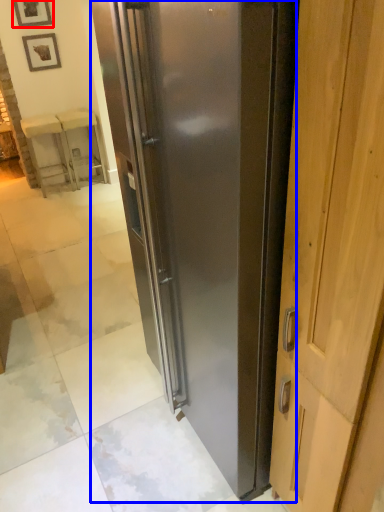
Question: Which object appears closest to the camera in this image, picture frame (highlighted by a red box) or refrigerator (highlighted by a blue box)?

Choices:
 (A) picture frame
 (B) refrigerator

Answer: (B)